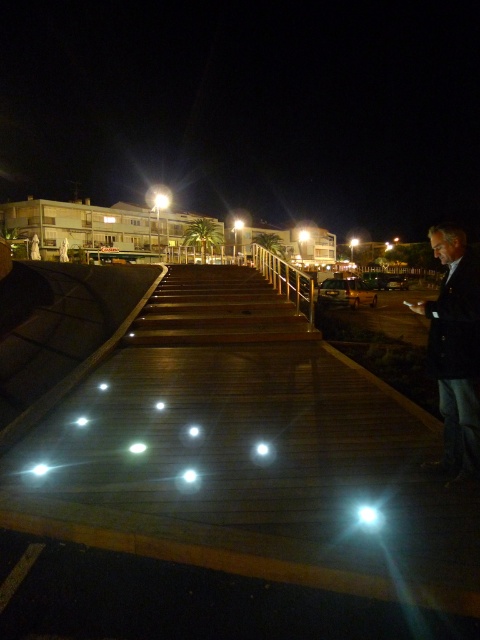
Which is more to the left, dark blue jacket at right or gold metallic railing at center?

gold metallic railing at center is more to the left.

Can you confirm if dark blue jacket at right is wider than gold metallic railing at center?

Indeed, dark blue jacket at right has a greater width compared to gold metallic railing at center.

Is point (455, 269) farther from camera compared to point (254, 243)?

No, it is not.

Where is `dark blue jacket at right`? Image resolution: width=480 pixels, height=640 pixels. dark blue jacket at right is located at coordinates (456, 349).